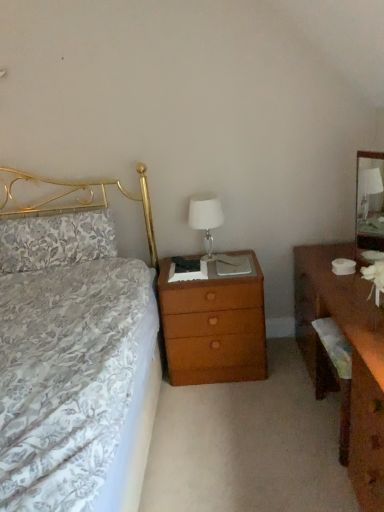
Describe the element at coordinates (352, 359) in the screenshot. I see `wooden desk at right` at that location.

In order to face clear glass mirror at right, should I rotate leftwards or rightwards?

A: It's best to rotate right around 23.920 degrees.

The width and height of the screenshot is (384, 512). What do you see at coordinates (214, 326) in the screenshot?
I see `brown wood nightstand at center` at bounding box center [214, 326].

Find the location of `wooden desk at right`. wooden desk at right is located at coordinates click(x=352, y=359).

Is white glass lampshade at center taller than brown wood nightstand at center?

No, white glass lampshade at center is not taller than brown wood nightstand at center.

Considering the sizes of white glass lampshade at center and brown wood nightstand at center in the image, is white glass lampshade at center wider or thinner than brown wood nightstand at center?

white glass lampshade at center is thinner than brown wood nightstand at center.

Is white glass lampshade at center looking in the opposite direction of brown wood nightstand at center?

That's not correct — white glass lampshade at center is not looking away from brown wood nightstand at center.

Does white glass lampshade at center have a smaller size compared to brown wood nightstand at center?

Yes.

Which of these two, clear glass mirror at right or white glass lampshade at center, is smaller?

white glass lampshade at center.

Which is correct: clear glass mirror at right is inside white glass lampshade at center, or outside of it?

clear glass mirror at right is located beyond the bounds of white glass lampshade at center.

Could you tell me if wooden desk at right is turned towards brown wood nightstand at center?

Yes, wooden desk at right faces towards brown wood nightstand at center.

Is wooden desk at right closer to camera compared to brown wood nightstand at center?

That is True.

Looking at this image, are wooden desk at right and brown wood nightstand at center located far from each other?

No, wooden desk at right is in close proximity to brown wood nightstand at center.

Considering the positions of point (355, 354) and point (211, 373), is point (355, 354) closer or farther from the camera than point (211, 373)?

Point (355, 354) is closer to the camera than point (211, 373).

Looking at this image, is white glass lampshade at center positioned before floral fabric pillow at left?

That is False.

Does white glass lampshade at center have a smaller size compared to floral fabric pillow at left?

Yes, white glass lampshade at center is smaller than floral fabric pillow at left.

Which point is more forward, (207,247) or (92,257)?

The point (92,257) is closer to the camera.

Can you confirm if white glass lampshade at center is thinner than floral fabric pillow at left?

Correct, the width of white glass lampshade at center is less than that of floral fabric pillow at left.

Where is `mirror positioned vertically above the brown wood nightstand at center (from a real-world perspective)`? This screenshot has height=512, width=384. mirror positioned vertically above the brown wood nightstand at center (from a real-world perspective) is located at coordinates (369, 201).

Who is bigger, brown wood nightstand at center or clear glass mirror at right?

With larger size is brown wood nightstand at center.

From the image's perspective, which object appears higher, brown wood nightstand at center or clear glass mirror at right?

From the image's view, clear glass mirror at right is above.

Between floral fabric pillow at left and brown wood nightstand at center, which one is positioned behind?

floral fabric pillow at left is further away from the camera.

Between floral fabric pillow at left and brown wood nightstand at center, which one has smaller width?

floral fabric pillow at left.

Are floral fabric pillow at left and brown wood nightstand at center far apart?

That's not correct — floral fabric pillow at left is a little close to brown wood nightstand at center.

Considering the sizes of objects floral fabric pillow at left and brown wood nightstand at center in the image provided, who is taller, floral fabric pillow at left or brown wood nightstand at center?

With more height is brown wood nightstand at center.

Choose the correct answer: Is white glass lampshade at center inside clear glass mirror at right or outside it?

white glass lampshade at center is not enclosed by clear glass mirror at right.

From a real-world perspective, is white glass lampshade at center on clear glass mirror at right?

Actually, white glass lampshade at center is physically below clear glass mirror at right in the real world.

Does white glass lampshade at center have a lesser height compared to clear glass mirror at right?

Correct, white glass lampshade at center is not as tall as clear glass mirror at right.

Is the position of white glass lampshade at center less distant than that of clear glass mirror at right?

No, it is behind clear glass mirror at right.

This screenshot has height=512, width=384. I want to click on bedside lamp located above the brown wood nightstand at center (from a real-world perspective), so click(205, 217).

You are a GUI agent. You are given a task and a screenshot of the screen. Output one action in this format:
    pyautogui.click(x=<x>, y=<y>)
    Task: Click on the bedside lamp behind the clear glass mirror at right
    
    Given the screenshot: What is the action you would take?
    pyautogui.click(x=205, y=217)

In the scene shown: From the image, which object appears to be farther from white glass lampshade at center, clear glass mirror at right or brown wood nightstand at center?

clear glass mirror at right is positioned further to the anchor white glass lampshade at center.

From the image, which object appears to be farther from brown wood nightstand at center, floral fabric pillow at left or clear glass mirror at right?

Based on the image, clear glass mirror at right appears to be further to brown wood nightstand at center.

Considering their positions, is brown wood nightstand at center positioned closer to floral fabric pillow at left than wooden desk at right?

brown wood nightstand at center lies closer to floral fabric pillow at left than the other object.

Based on the photo, estimate the real-world distances between objects in this image. Which object is closer to wooden desk at right, floral fabric pillow at left or brown wood nightstand at center?

brown wood nightstand at center.

When comparing their distances from floral fabric pillow at left, does white glass lampshade at center or clear glass mirror at right seem closer?

Among the two, white glass lampshade at center is located nearer to floral fabric pillow at left.

From the image, which object appears to be nearer to white glass lampshade at center, wooden desk at right or clear glass mirror at right?

Among the two, wooden desk at right is located nearer to white glass lampshade at center.

Which object lies further to the anchor point wooden desk at right, white glass lampshade at center or clear glass mirror at right?

Based on the image, white glass lampshade at center appears to be further to wooden desk at right.

From the image, which object appears to be farther from floral fabric pillow at left, wooden desk at right or white glass lampshade at center?

wooden desk at right is further to floral fabric pillow at left.

The height and width of the screenshot is (512, 384). I want to click on desk between floral fabric pillow at left and clear glass mirror at right in the horizontal direction, so click(x=352, y=359).

At what (x,y) coordinates should I click in order to perform the action: click on nightstand between floral fabric pillow at left and wooden desk at right. Please return your answer as a coordinate pair (x, y). Looking at the image, I should click on (214, 326).

Image resolution: width=384 pixels, height=512 pixels. In order to click on bedside lamp between floral fabric pillow at left and brown wood nightstand at center from left to right in this screenshot , I will do `click(205, 217)`.

Where is `nightstand located between white glass lampshade at center and clear glass mirror at right in the left-right direction`? Image resolution: width=384 pixels, height=512 pixels. nightstand located between white glass lampshade at center and clear glass mirror at right in the left-right direction is located at coordinates (214, 326).